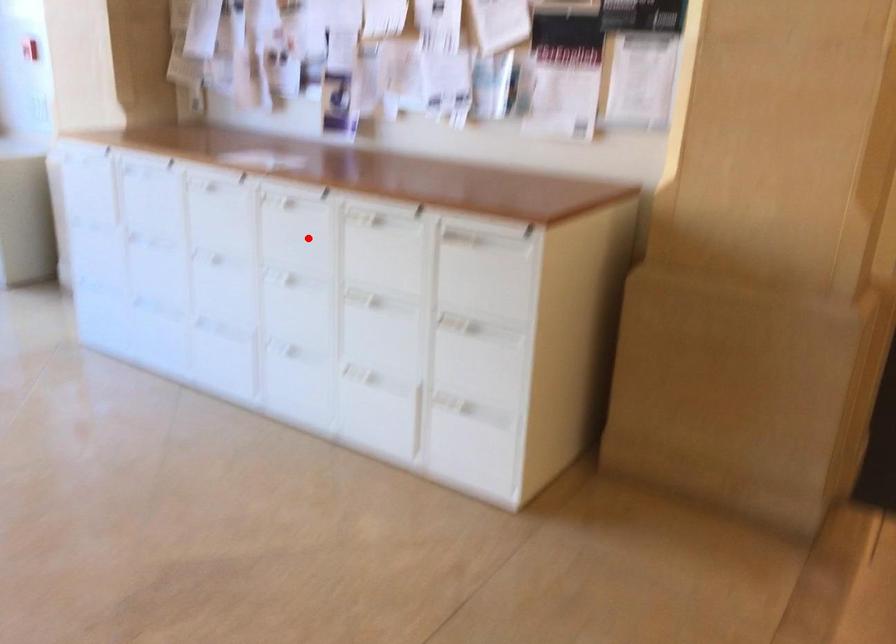
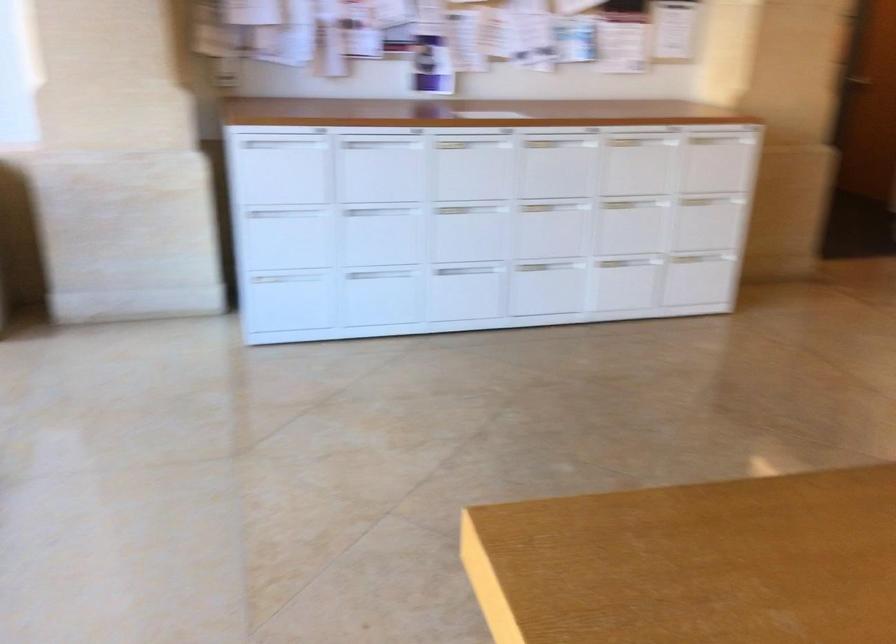
Question: I am providing you with two images of the same scene from different viewpoints. In image1, a red point is highlighted. Considering the same 3D point in image2, which of the following is correct?

Choices:
 (A) It is closer
 (B) It is farther

Answer: (B)